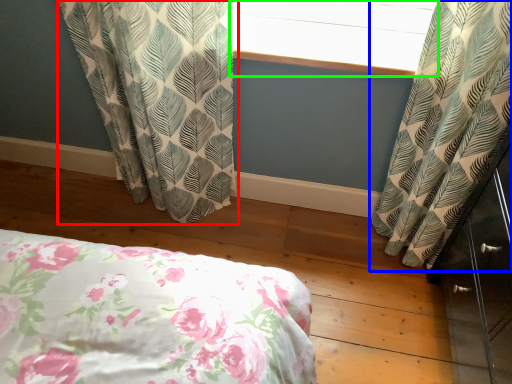
Question: Based on their relative distances, which object is farther from curtain (highlighted by a red box)? Choose from curtain (highlighted by a blue box) and window screen (highlighted by a green box).

Choices:
 (A) curtain
 (B) window screen

Answer: (A)